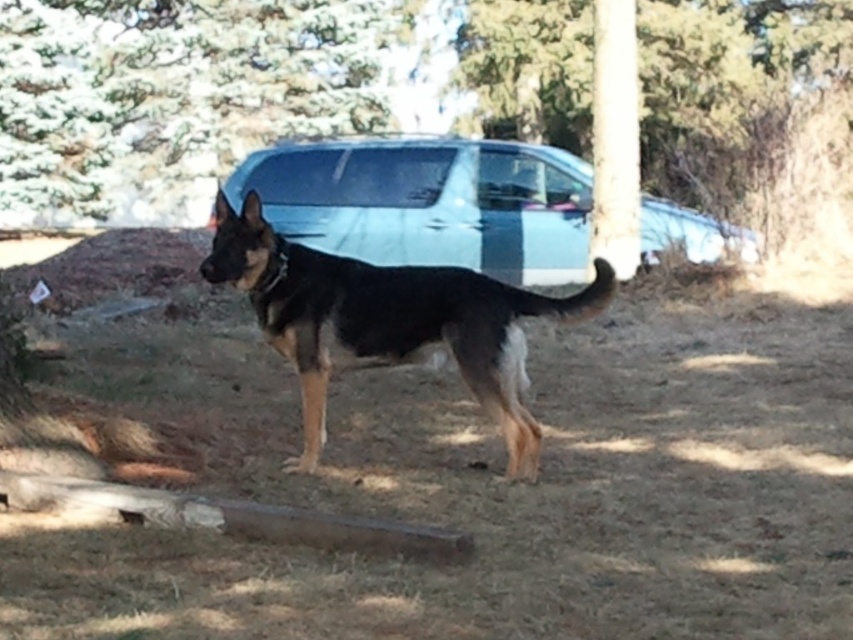
Question: Is satin silver car at center further to the viewer compared to black glossy dog at center?

Choices:
 (A) no
 (B) yes

Answer: (B)

Question: Is green textured tree at upper left wider than black glossy dog at center?

Choices:
 (A) no
 (B) yes

Answer: (B)

Question: Among these objects, which one is nearest to the camera?

Choices:
 (A) green textured tree at upper left
 (B) black glossy dog at center
 (C) smooth bark tree at center

Answer: (B)

Question: Which is farther from the satin silver car at center?

Choices:
 (A) green textured tree at upper left
 (B) black glossy dog at center

Answer: (A)

Question: Which point is closer to the camera?

Choices:
 (A) (520, 17)
 (B) (437, 188)
 (C) (105, 196)

Answer: (B)

Question: Does satin silver car at center have a smaller size compared to black glossy dog at center?

Choices:
 (A) no
 (B) yes

Answer: (A)